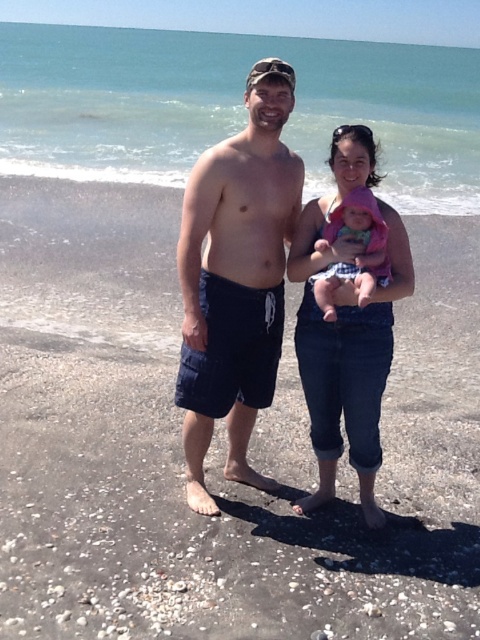
The width and height of the screenshot is (480, 640). What do you see at coordinates (236, 278) in the screenshot?
I see `dark blue shorts at center` at bounding box center [236, 278].

Is point (236, 365) in front of point (342, 349)?

No, (236, 365) is behind (342, 349).

Between point (248, 292) and point (300, 344), which one is positioned in front?

Point (248, 292) is more forward.

Where is `dark blue shorts at center`? This screenshot has height=640, width=480. dark blue shorts at center is located at coordinates (236, 278).

Is smooth sand at center positioned in front of dark blue shorts at center?

Yes, smooth sand at center is in front of dark blue shorts at center.

Between smooth sand at center and dark blue shorts at center, which one appears on the left side from the viewer's perspective?

dark blue shorts at center

Locate an element on the screen. This screenshot has height=640, width=480. smooth sand at center is located at coordinates (216, 448).

Who is more distant from viewer, (442, 248) or (328, 157)?

Point (442, 248)

This screenshot has width=480, height=640. Find the location of `smooth sand at center`. smooth sand at center is located at coordinates (216, 448).